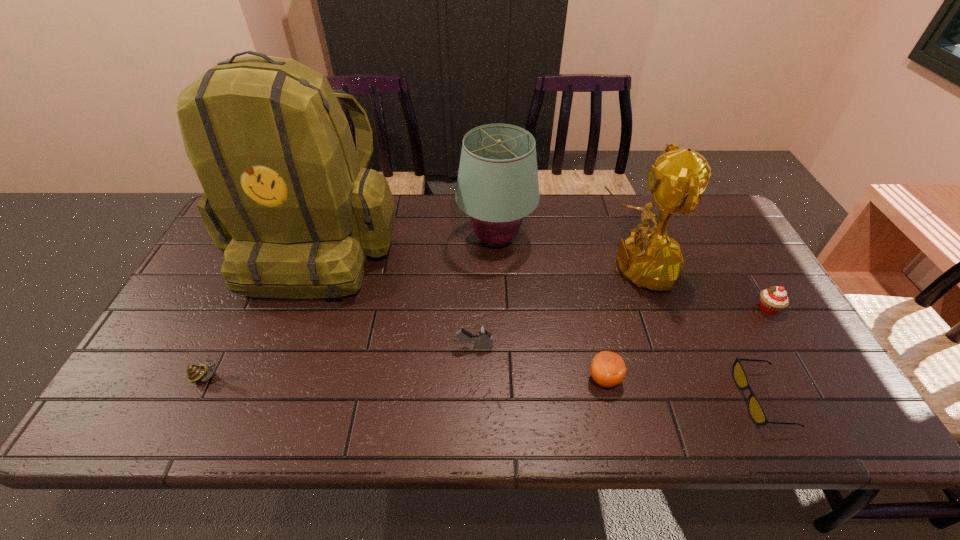
Locate an element on the screen. Image resolution: width=960 pixels, height=540 pixels. free space between the sunglasses and the award is located at coordinates (698, 333).

Where is `empty location between the tallest object and the igniter`? The image size is (960, 540). empty location between the tallest object and the igniter is located at coordinates (396, 295).

The height and width of the screenshot is (540, 960). Find the location of `free point between the seventh object from left to right and the orange`. free point between the seventh object from left to right and the orange is located at coordinates (684, 389).

Select which object is the third closest to the cupcake. Please provide its 2D coordinates. Your answer should be formatted as a tuple, i.e. [(x, y)], where the tuple contains the x and y coordinates of a point satisfying the conditions above.

[(607, 369)]

Locate an element on the screen. This screenshot has width=960, height=540. object that stands as the fifth closest to the lampshade is located at coordinates (757, 413).

Where is `free space that satisfies the following two spatial constraints: 1. on the back side of the fourth nearest object; 2. on the left side of the rightmost object`? This screenshot has height=540, width=960. free space that satisfies the following two spatial constraints: 1. on the back side of the fourth nearest object; 2. on the left side of the rightmost object is located at coordinates (474, 308).

Find the location of `blank space that satisfies the following two spatial constraints: 1. on the front-facing side of the orange; 2. on the left side of the backpack`. blank space that satisfies the following two spatial constraints: 1. on the front-facing side of the orange; 2. on the left side of the backpack is located at coordinates coord(265,379).

In order to click on vacant position in the image that satisfies the following two spatial constraints: 1. on the front-facing side of the backpack; 2. on the face of the snail in this screenshot , I will do `click(265, 377)`.

This screenshot has height=540, width=960. I want to click on vacant region that satisfies the following two spatial constraints: 1. on the face of the snail; 2. on the left side of the orange, so click(x=207, y=379).

Where is `free space that satisfies the following two spatial constraints: 1. on the front-facing side of the backpack; 2. on the face of the snail`? The width and height of the screenshot is (960, 540). free space that satisfies the following two spatial constraints: 1. on the front-facing side of the backpack; 2. on the face of the snail is located at coordinates (265, 377).